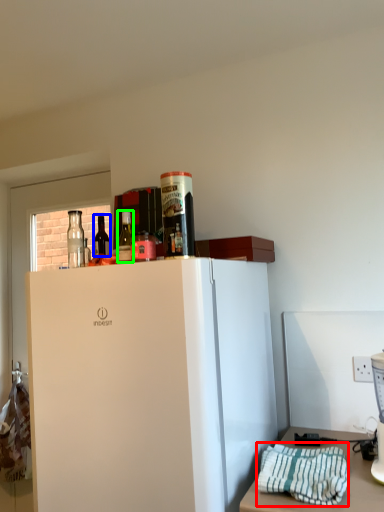
Question: Estimate the real-world distances between objects in this image. Which object is farther from blanket (highlighted by a red box), bottle (highlighted by a blue box) or bottle (highlighted by a green box)?

Choices:
 (A) bottle
 (B) bottle

Answer: (A)